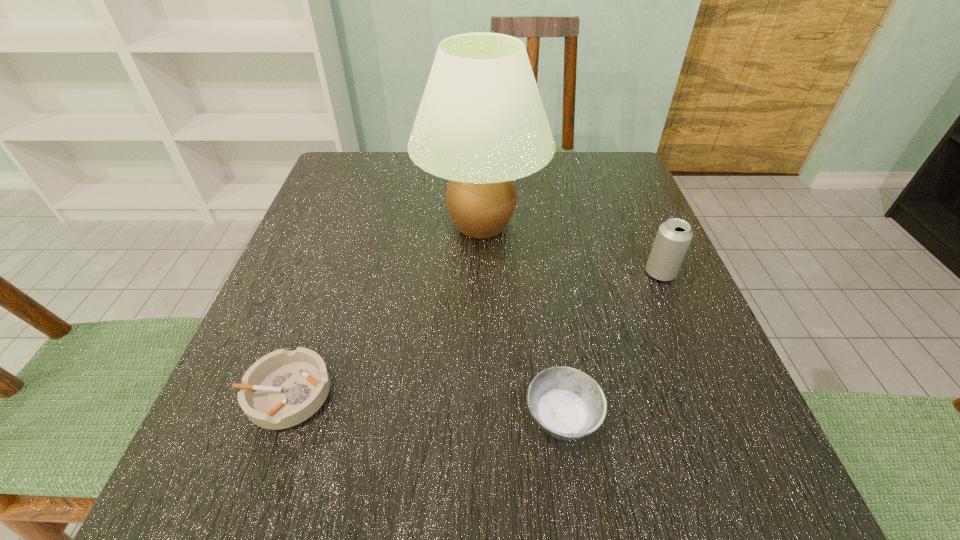
Image resolution: width=960 pixels, height=540 pixels. Identify the location of the tallest object. (481, 123).

Locate an element on the screen. The height and width of the screenshot is (540, 960). the second tallest object is located at coordinates (673, 238).

The height and width of the screenshot is (540, 960). Find the location of `beer can`. beer can is located at coordinates (673, 238).

The image size is (960, 540). I want to click on the third tallest object, so click(567, 403).

This screenshot has width=960, height=540. Identify the location of the right ashtray. (567, 403).

At what (x,y) coordinates should I click in order to perform the action: click on the leftmost object. Please return your answer as a coordinate pair (x, y). The image size is (960, 540). Looking at the image, I should click on (284, 388).

In order to click on the shortest object in this screenshot , I will do `click(284, 388)`.

This screenshot has height=540, width=960. Identify the location of blank area located on the shade of the lampshade. (370, 225).

Where is `blank space located 0.210m on the shade of the lampshade`? blank space located 0.210m on the shade of the lampshade is located at coordinates (317, 225).

The height and width of the screenshot is (540, 960). In order to click on free spot located 0.240m on the shade of the lampshade in this screenshot , I will do click(x=302, y=225).